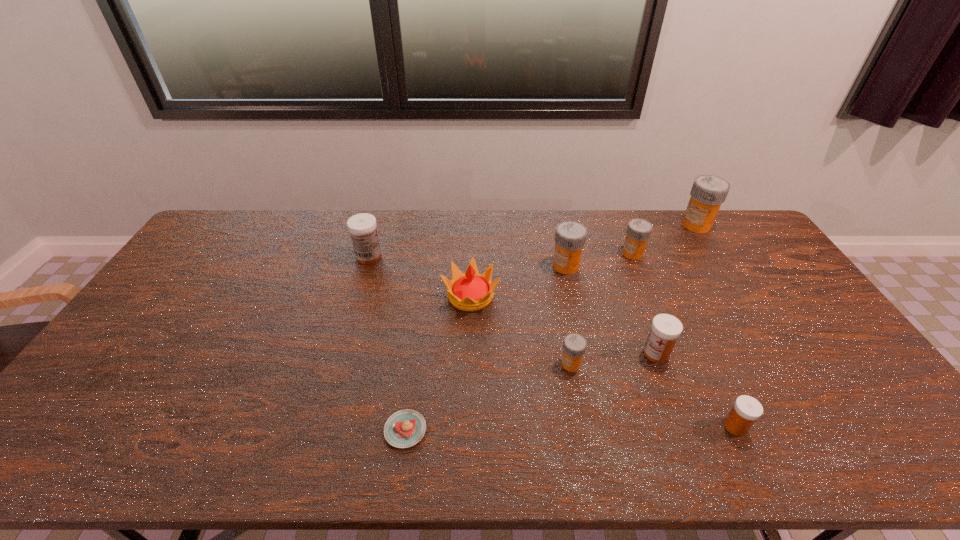
At what (x,y) coordinates should I click in order to perform the action: click on vacant space at the far left corner of the desktop. Please return your answer as a coordinate pair (x, y). The image size is (960, 540). Looking at the image, I should click on (205, 237).

This screenshot has height=540, width=960. In order to click on free space between the nearest orange medicine and the shortest object in this screenshot , I will do `click(488, 397)`.

The width and height of the screenshot is (960, 540). Identify the location of vacant space that is in between the second smallest white medicine and the second orange medicine from right to left. (644, 303).

At what (x,y) coordinates should I click in order to perform the action: click on free space between the seventh object from right to left and the tallest medicine. Please return your answer as a coordinate pair (x, y). The height and width of the screenshot is (540, 960). Looking at the image, I should click on (584, 260).

Where is `vacant space in between the pastry and the smallest orange medicine`? The height and width of the screenshot is (540, 960). vacant space in between the pastry and the smallest orange medicine is located at coordinates (488, 397).

Image resolution: width=960 pixels, height=540 pixels. In order to click on free space between the second biggest orange medicine and the shortest object in this screenshot , I will do `click(486, 348)`.

Where is `empty location between the second object from right to left and the smallest orange medicine`? empty location between the second object from right to left and the smallest orange medicine is located at coordinates (653, 395).

The image size is (960, 540). Identify the location of vacant area between the tallest medicine and the biggest white medicine. (533, 241).

You are a GUI agent. You are given a task and a screenshot of the screen. Output one action in this format:
    pyautogui.click(x=<x>, y=<y>)
    Task: Click on the free space between the second white medicine from left to right and the crown
    
    Given the screenshot: What is the action you would take?
    pyautogui.click(x=564, y=325)

This screenshot has width=960, height=540. In order to click on object that is the seventh closest one to the third orange medicine from left to right in this screenshot , I will do `click(362, 227)`.